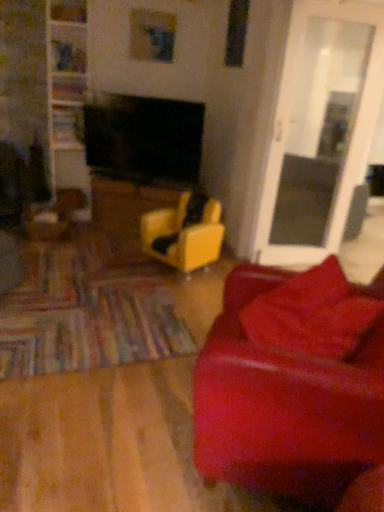
Question: Which is correct: yellow leather chair at center is inside yellow matte table at center, or outside of it?

Choices:
 (A) inside
 (B) outside

Answer: (B)

Question: Is yellow leather chair at center taller or shorter than yellow matte table at center?

Choices:
 (A) short
 (B) tall

Answer: (B)

Question: Estimate the real-world distances between objects in this image. Which object is closer to the transparent glass door at right?

Choices:
 (A) velvet red pillow at lower right
 (B) yellow leather chair at center
 (C) leather couch at right
 (D) yellow matte table at center

Answer: (B)

Question: Estimate the real-world distances between objects in this image. Which object is farther from the velvet red pillow at lower right?

Choices:
 (A) transparent glass door at right
 (B) yellow leather chair at center
 (C) leather couch at right
 (D) yellow matte table at center

Answer: (D)